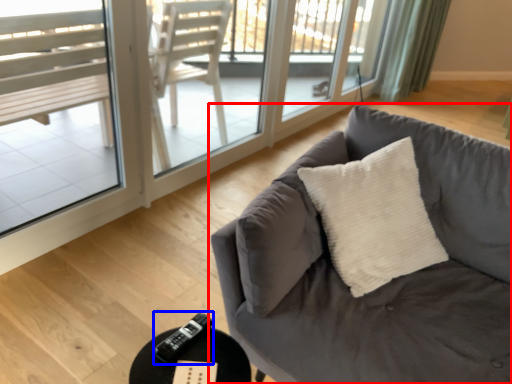
Question: Which point is closer to the camera, studio couch (highlighted by a red box) or remote (highlighted by a blue box)?

Choices:
 (A) studio couch
 (B) remote

Answer: (A)